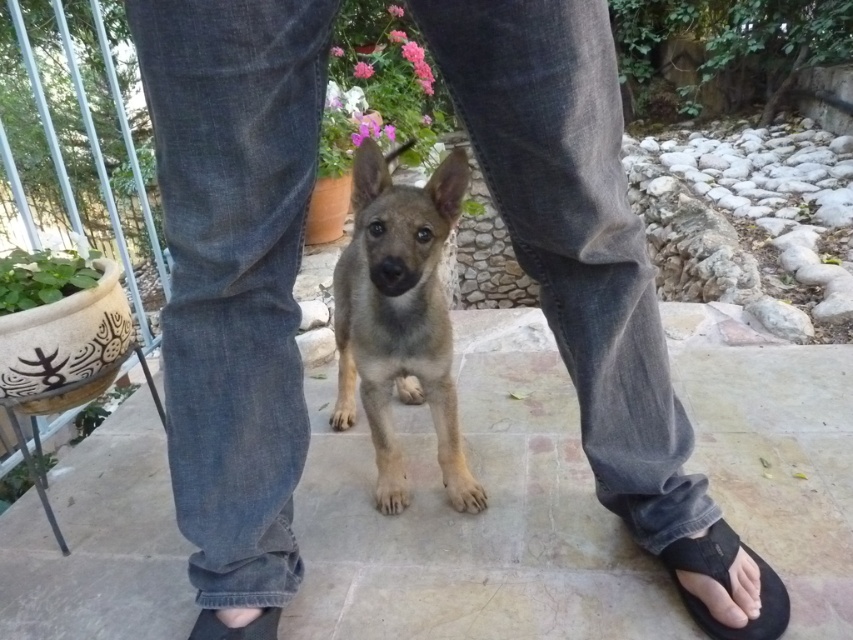
From the picture: You are a delivery robot that needs to move a package from the fuzzy brown puppy at center to the black rubber sandal at lower center. Can you safely navigate the 25.22 inches between them without stepping on either object?

The distance between the fuzzy brown puppy at center and the black rubber sandal at lower center is 25.22 inches, so yes, the robot can navigate the space between them safely as long as it maintains that distance and avoids stepping on either object.

You are a photographer trying to capture the fuzzy brown puppy at center without including the black rubber sandal at lower right in the frame. Based on their positions, is this possible?

The black rubber sandal at lower right is behind the fuzzy brown puppy at center, so yes, you can position the camera to focus on the puppy while excluding the sandal by framing around the puppy.

You are a small dog who wants to get to the black rubber sandal at lower center. You are currently near the black rubber sandal at lower right. Which direction should you move to reach your target?

The black rubber sandal at lower right is closer to you than the black rubber sandal at lower center. To reach the black rubber sandal at lower center, you should move backward away from the black rubber sandal at lower right.